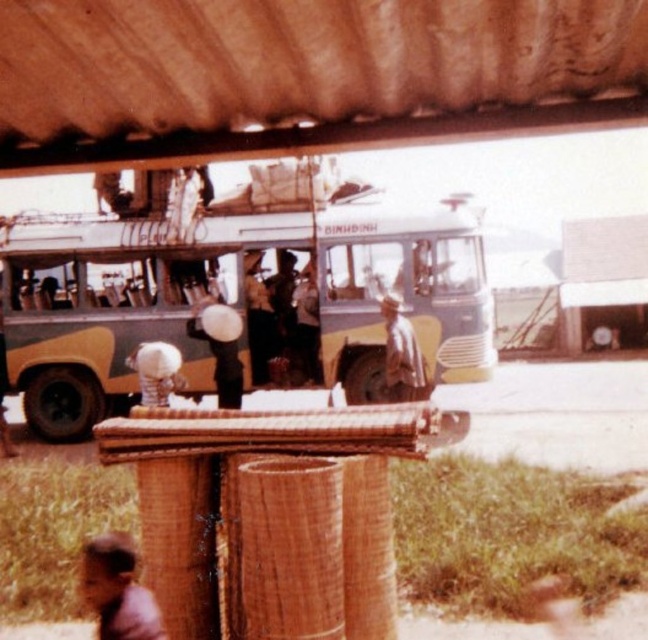
Does brown leather jacket at lower left lie in front of brown woven hat at center?

Yes, it is.

Who is more forward, (82, 563) or (395, 396)?

Point (82, 563) is more forward.

The height and width of the screenshot is (640, 648). Identify the location of brown leather jacket at lower left. (117, 589).

Is point (135, 636) farther from viewer compared to point (207, 300)?

No, (135, 636) is in front of (207, 300).

Which is more to the right, brown leather jacket at lower left or white matte hat at center?

brown leather jacket at lower left

You are a GUI agent. You are given a task and a screenshot of the screen. Output one action in this format:
    pyautogui.click(x=<x>, y=<y>)
    Task: Click on the brown leather jacket at lower left
    The width and height of the screenshot is (648, 640).
    Given the screenshot: What is the action you would take?
    pyautogui.click(x=117, y=589)

Between yellow matte bus at center and brown woven hat at center, which one has less height?

Standing shorter between the two is yellow matte bus at center.

Which is more to the right, yellow matte bus at center or brown woven hat at center?

Positioned to the right is brown woven hat at center.

Is point (51, 413) positioned in front of point (424, 376)?

No, it is not.

Where is `yellow matte bus at center`? This screenshot has width=648, height=640. yellow matte bus at center is located at coordinates (238, 298).